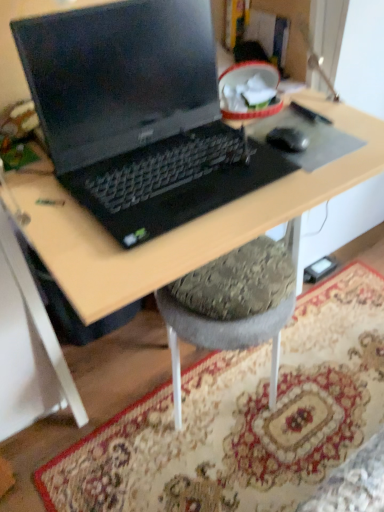
Find the location of `free spot above black matte mousepad at center (from a real-world perspective)`. free spot above black matte mousepad at center (from a real-world perspective) is located at coordinates (299, 135).